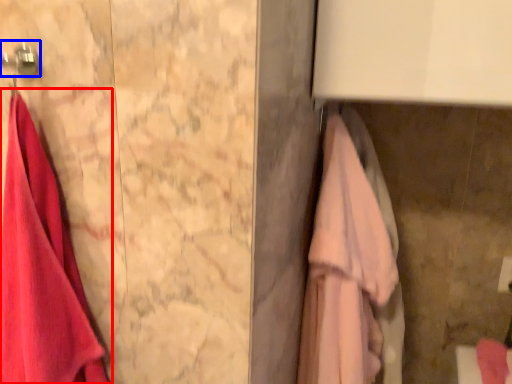
Question: Among these objects, which one is farthest to the camera, towel (highlighted by a red box) or hanger (highlighted by a blue box)?

Choices:
 (A) towel
 (B) hanger

Answer: (B)